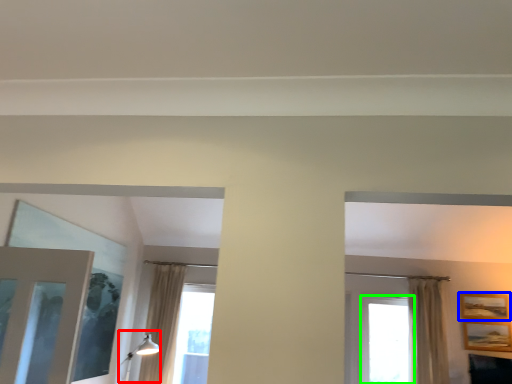
Question: Based on their relative distances, which object is nearer to light fixture (highlighted by a red box)? Choose from picture frame (highlighted by a blue box) and window (highlighted by a green box).

Choices:
 (A) picture frame
 (B) window

Answer: (B)